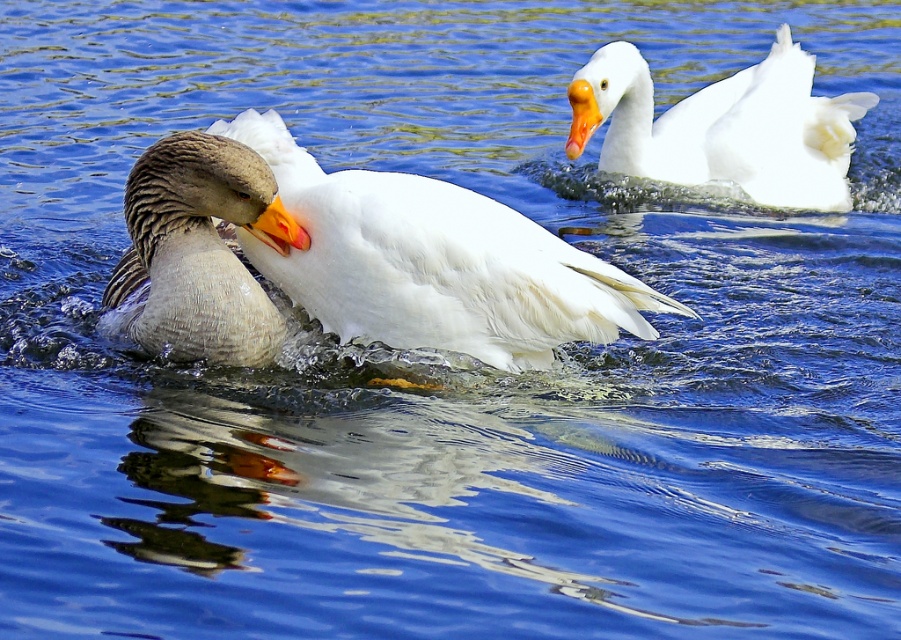
Consider the image. You are a birdwatcher observing the scene. You notice the white feathered duck at center and the orange glossy beak at upper right. Which object is positioned higher in the image?

The orange glossy beak at upper right is positioned higher in the image than the white feathered duck at center.

You are standing at the edge of the water and see the point marked at coordinates (434, 262). What animal is located at that point?

The point at (434, 262) marks the location of the white feathered duck at center.

You are a wildlife photographer aiming to capture the tallest goose in the image. Which one should you focus on between the white feathered duck at center and the gray feathered duck at center?

The white feathered duck at center is taller than the gray feathered duck at center, so you should focus on the white feathered duck at center to capture the tallest goose.